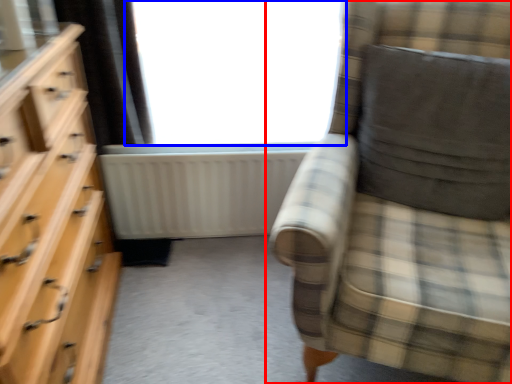
Question: Among these objects, which one is farthest to the camera, chair (highlighted by a red box) or window (highlighted by a blue box)?

Choices:
 (A) chair
 (B) window

Answer: (B)